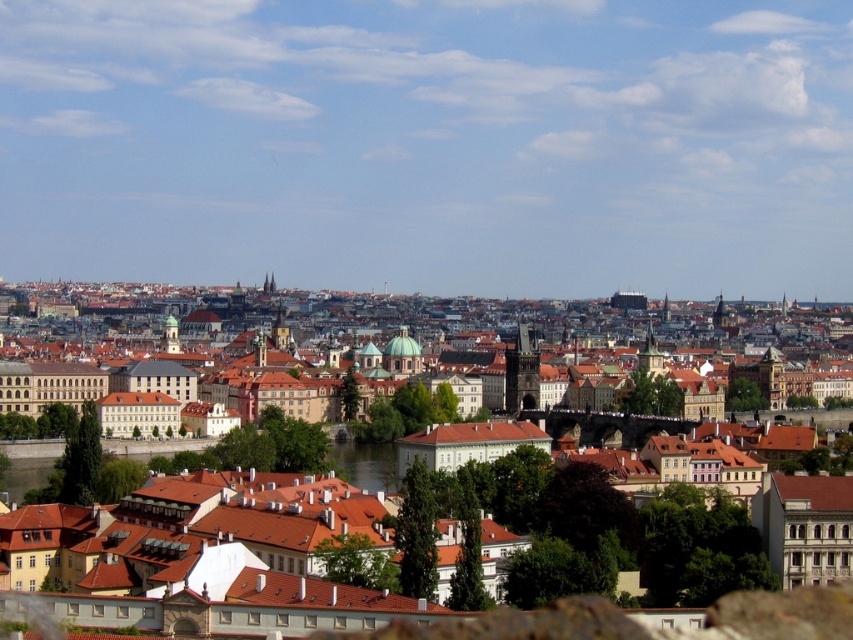
Question: Which object appears closest to the camera in this image?

Choices:
 (A) brown stone buildings at center
 (B) greenish water at center

Answer: (B)

Question: Which object appears farthest from the camera in this image?

Choices:
 (A) brown stone buildings at center
 (B) greenish water at center

Answer: (A)

Question: In this image, where is brown stone buildings at center located relative to greenish water at center?

Choices:
 (A) below
 (B) above

Answer: (B)

Question: Is brown stone buildings at center below greenish water at center?

Choices:
 (A) yes
 (B) no

Answer: (B)

Question: Is brown stone buildings at center closer to camera compared to greenish water at center?

Choices:
 (A) yes
 (B) no

Answer: (B)